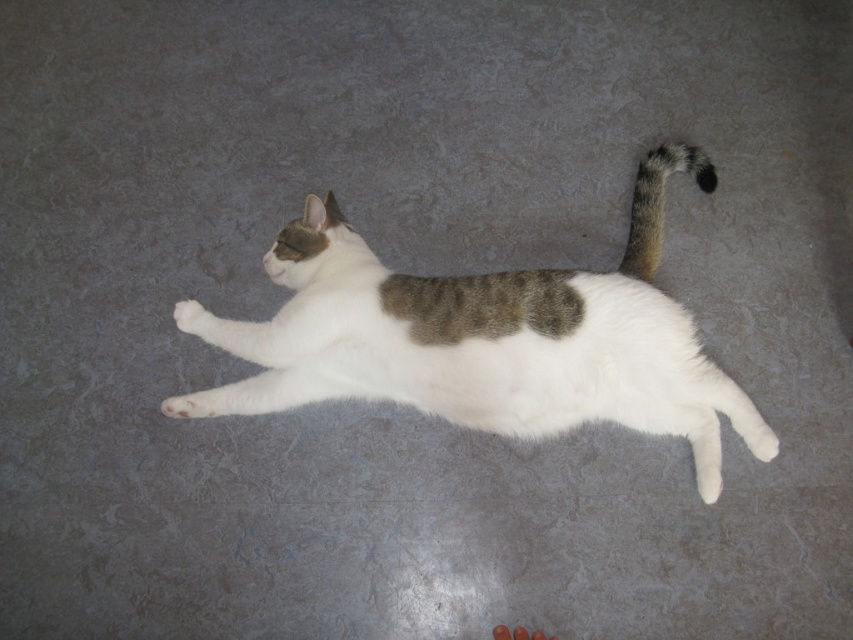
Question: Which point is closer to the camera?

Choices:
 (A) white fur paw at center
 (B) white fur cat at center
 (C) striped fur tail at upper right

Answer: (B)

Question: Which object is the farthest from the white fur cat at center?

Choices:
 (A) white fur paw at lower left
 (B) striped fur tail at upper right
 (C) white fur paw at center

Answer: (A)

Question: Which point appears farthest from the camera in this image?

Choices:
 (A) (659, 180)
 (B) (184, 330)
 (C) (192, 401)

Answer: (A)

Question: Does white fur cat at center appear over white fur paw at center?

Choices:
 (A) no
 (B) yes

Answer: (A)

Question: In this image, where is white fur cat at center located relative to white fur paw at center?

Choices:
 (A) right
 (B) left

Answer: (A)

Question: Observing the image, what is the correct spatial positioning of white fur cat at center in reference to white fur paw at lower left?

Choices:
 (A) left
 (B) right

Answer: (B)